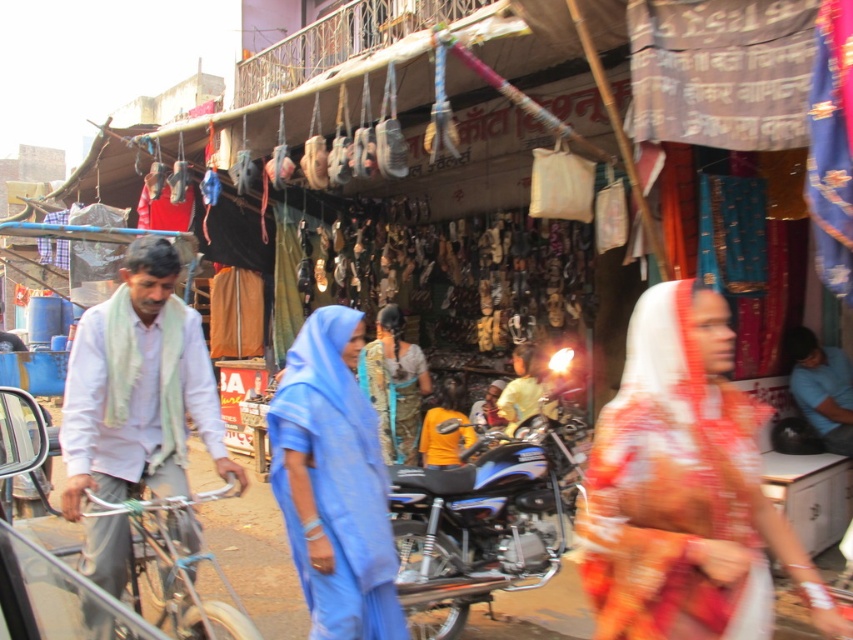
Question: Estimate the real-world distances between objects in this image. Which object is farther from the camouflage-patterned shirt at center?

Choices:
 (A) blue fabric headscarf at upper center
 (B) yellow fabric shirt at center
 (C) white cotton shirt at left
 (D) shiny metallic motorcycle at center

Answer: (A)

Question: Is white cotton shirt at left positioned at the back of camouflage-patterned shirt at center?

Choices:
 (A) yes
 (B) no

Answer: (B)

Question: In this image, where is white cotton shirt at left located relative to camouflage-patterned shirt at center?

Choices:
 (A) left
 (B) right

Answer: (A)

Question: Estimate the real-world distances between objects in this image. Which object is farther from the blue fabric headscarf at upper center?

Choices:
 (A) yellow fabric shirt at center
 (B) white cotton shirt at left

Answer: (B)

Question: Among these objects, which one is nearest to the camera?

Choices:
 (A) yellow fabric shirt at center
 (B) shiny metallic motorcycle at center

Answer: (B)

Question: Can you confirm if white cotton shirt at left is positioned below blue fabric headscarf at upper center?

Choices:
 (A) no
 (B) yes

Answer: (A)